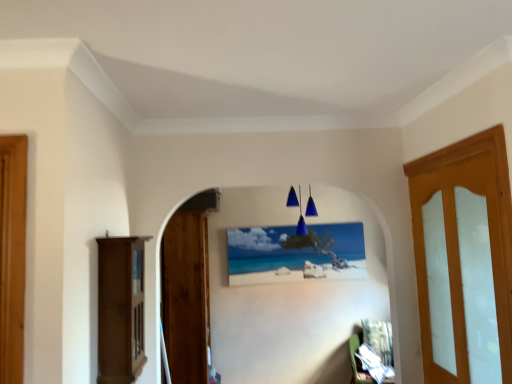
Locate an element on the screen. Image resolution: width=512 pixels, height=384 pixels. free spot above matte canvas painting at center (from a real-world perspective) is located at coordinates (285, 223).